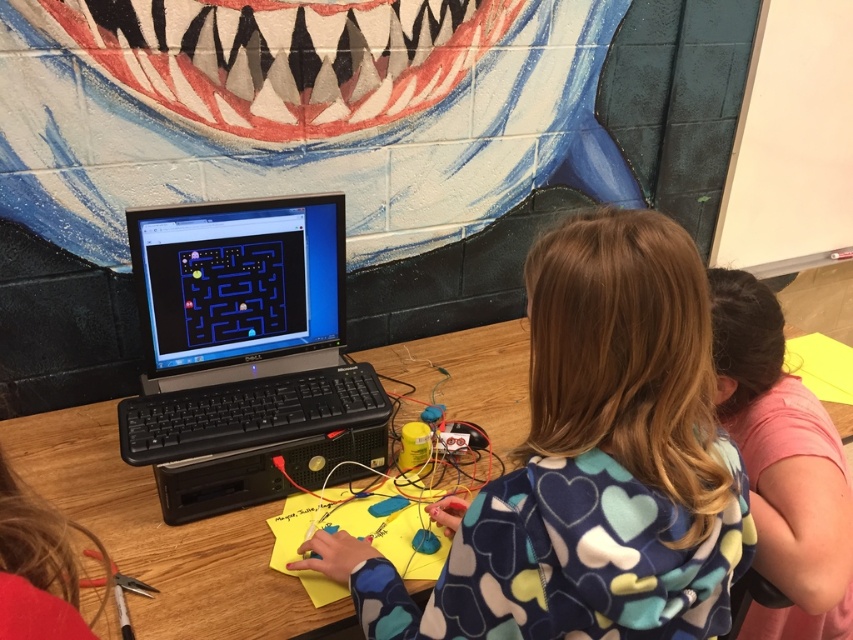
From the picture: Between wooden table at center and pink fabric shirt at upper right, which one is positioned higher?

pink fabric shirt at upper right is above.

Is wooden table at center below pink fabric shirt at upper right?

Indeed, wooden table at center is positioned under pink fabric shirt at upper right.

This screenshot has height=640, width=853. In order to click on wooden table at center in this screenshot , I will do `click(161, 536)`.

Where is `wooden table at center`? This screenshot has height=640, width=853. wooden table at center is located at coordinates (161, 536).

Can you confirm if blue heart-patterned hoodie at center is positioned to the left of black plastic laptop at center?

In fact, blue heart-patterned hoodie at center is to the right of black plastic laptop at center.

Is blue heart-patterned hoodie at center to the right of black plastic laptop at center from the viewer's perspective?

Indeed, blue heart-patterned hoodie at center is positioned on the right side of black plastic laptop at center.

Between point (561, 630) and point (270, 429), which one is positioned in front?

Point (561, 630) is more forward.

Locate an element on the screen. The height and width of the screenshot is (640, 853). blue heart-patterned hoodie at center is located at coordinates (590, 465).

Is black plastic laptop at center closer to the viewer compared to pink fabric shirt at upper right?

No, black plastic laptop at center is further to the viewer.

Can you confirm if black plastic laptop at center is positioned below pink fabric shirt at upper right?

No, black plastic laptop at center is not below pink fabric shirt at upper right.

Find the location of `black plastic laptop at center`. black plastic laptop at center is located at coordinates (247, 355).